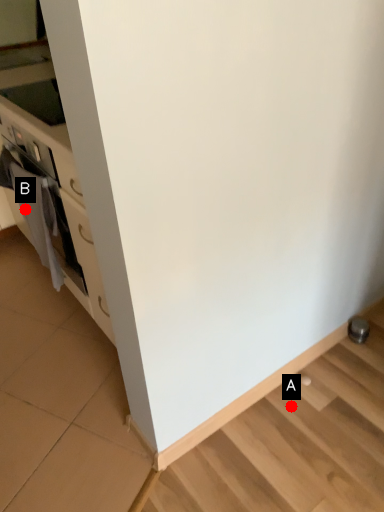
Question: Two points are circled on the image, labeled by A and B beside each circle. Which point appears farthest from the camera in this image?

Choices:
 (A) A is further
 (B) B is further

Answer: (B)